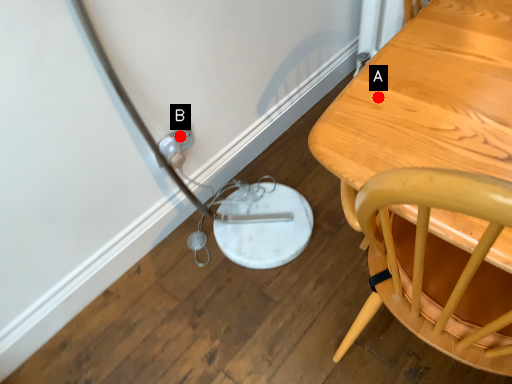
Question: Two points are circled on the image, labeled by A and B beside each circle. Which point is closer to the camera?

Choices:
 (A) A is closer
 (B) B is closer

Answer: (A)